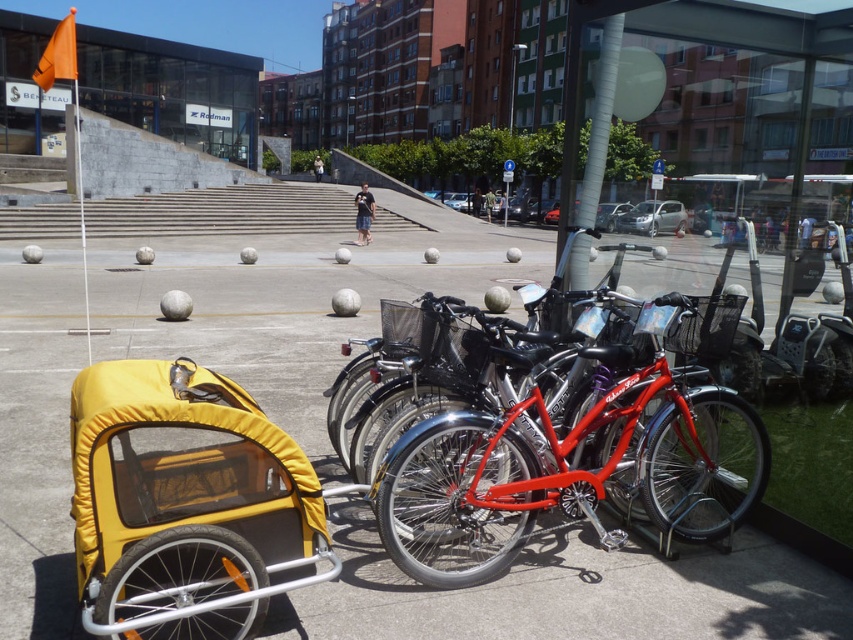
Question: Does gray concrete pavement at center appear on the left side of shiny metallic bicycle at center?

Choices:
 (A) yes
 (B) no

Answer: (A)

Question: Does yellow fabric baby carriage at lower left have a greater width compared to shiny metallic bicycle at center?

Choices:
 (A) yes
 (B) no

Answer: (B)

Question: Does gray concrete pavement at center appear over shiny metallic bicycle at center?

Choices:
 (A) yes
 (B) no

Answer: (A)

Question: Which point is closer to the camera?

Choices:
 (A) gray concrete pavement at center
 (B) yellow fabric baby carriage at lower left

Answer: (B)

Question: Which point is closer to the camera?

Choices:
 (A) gray concrete pavement at center
 (B) shiny metallic bicycle at center

Answer: (A)

Question: Estimate the real-world distances between objects in this image. Which object is farther from the gray concrete pavement at center?

Choices:
 (A) yellow fabric baby carriage at lower left
 (B) shiny metallic bicycle at center

Answer: (B)